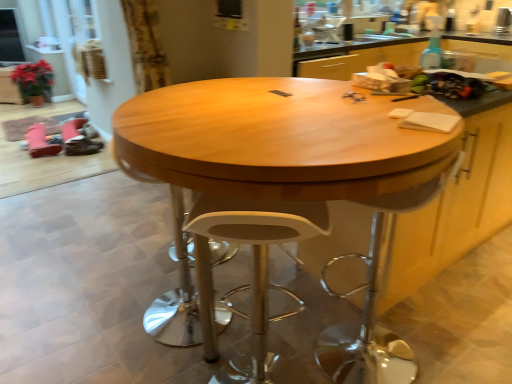
At what (x,y) coordinates should I click in order to perform the action: click on blank space to the left of white plastic swivel chair at center. Please return your answer as a coordinate pair (x, y). Image resolution: width=512 pixels, height=384 pixels. Looking at the image, I should click on (282, 339).